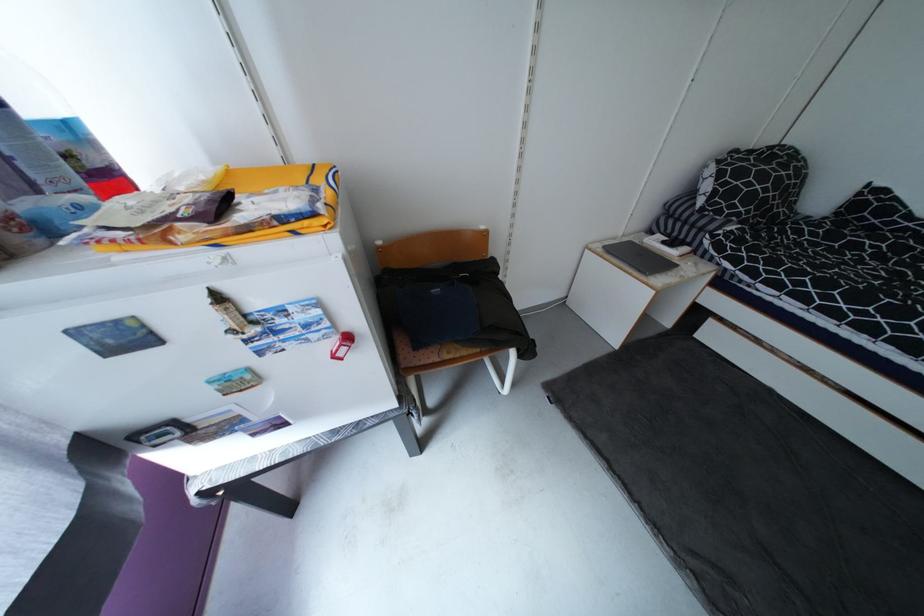
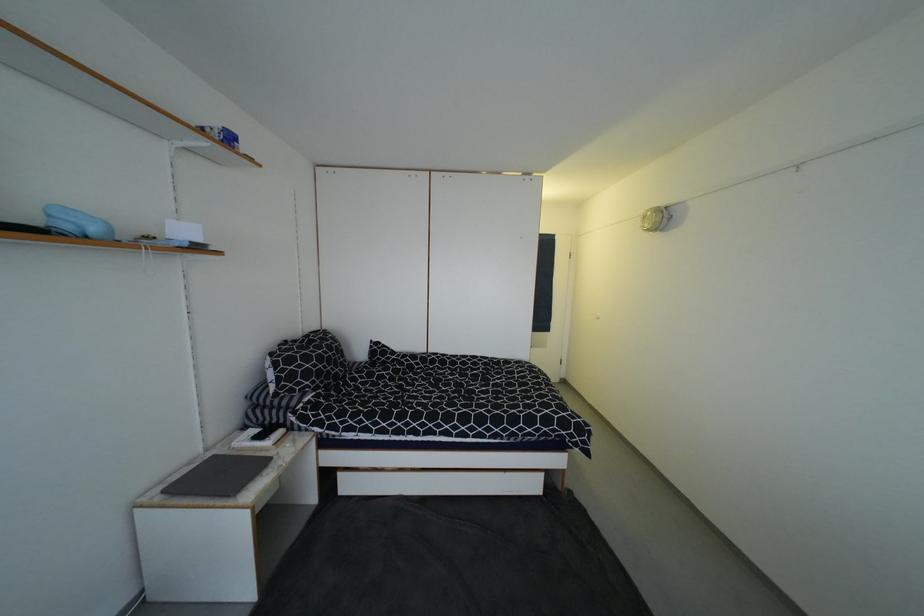
Locate, in the second image, the point that corresponds to point 687,238 in the first image.

(281, 423)